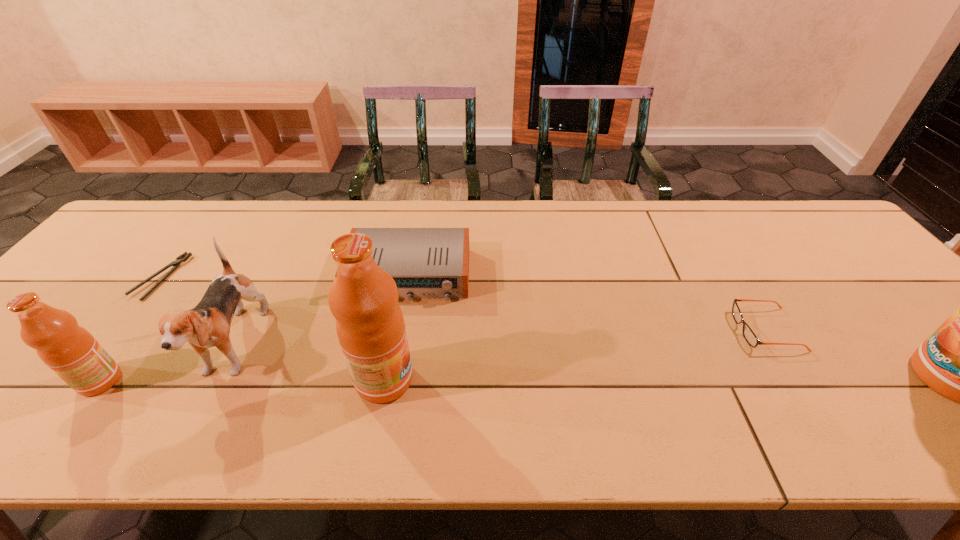
Where is `the leftmost fruit juice`? the leftmost fruit juice is located at coordinates (68, 349).

Where is `the second shortest fruit juice`? the second shortest fruit juice is located at coordinates (363, 298).

Where is `the second tallest object`? Image resolution: width=960 pixels, height=540 pixels. the second tallest object is located at coordinates (363, 298).

The height and width of the screenshot is (540, 960). I want to click on tongs, so click(185, 256).

Locate an element on the screen. the second shortest object is located at coordinates (750, 337).

At what (x,y) coordinates should I click in order to perform the action: click on the sixth object from left to right. Please return your answer as a coordinate pair (x, y). This screenshot has width=960, height=540. Looking at the image, I should click on (750, 337).

You are a GUI agent. You are given a task and a screenshot of the screen. Output one action in this format:
    pyautogui.click(x=<x>, y=<y>)
    Task: Click on the radio receiver
    
    Given the screenshot: What is the action you would take?
    pyautogui.click(x=425, y=262)

Find the location of a particular element. This screenshot has width=960, height=540. puppy is located at coordinates (207, 325).

Image resolution: width=960 pixels, height=540 pixels. In order to click on free space located on the label side of the leftmost fruit juice in this screenshot , I will do `click(43, 381)`.

Locate an element on the screen. The width and height of the screenshot is (960, 540). free space located on the label side of the leftmost fruit juice is located at coordinates (7, 381).